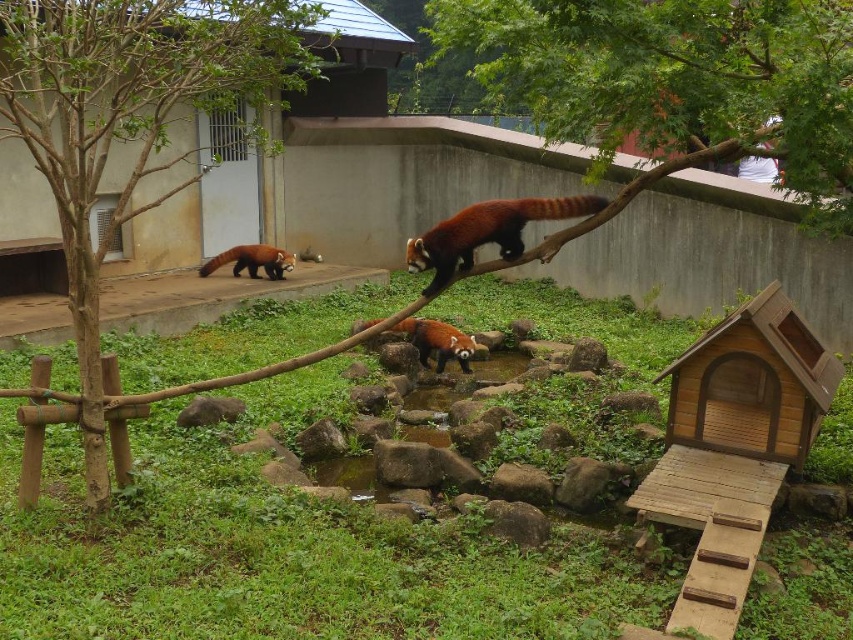
Question: Estimate the real-world distances between objects in this image. Which object is farther from the green leafy tree at left?

Choices:
 (A) fuzzy reddish-brown animal at center
 (B) fluffy reddish-brown panda at upper center
 (C) green leafy tree at upper center

Answer: (A)

Question: Which object is farther from the camera taking this photo?

Choices:
 (A) brown furry animal at center
 (B) green leafy tree at left
 (C) fuzzy reddish-brown animal at center

Answer: (A)

Question: Is fluffy reddish-brown panda at upper center to the right of fuzzy reddish-brown animal at center from the viewer's perspective?

Choices:
 (A) yes
 (B) no

Answer: (A)

Question: Does fluffy reddish-brown panda at upper center appear under brown furry animal at center?

Choices:
 (A) yes
 (B) no

Answer: (A)

Question: Is green leafy tree at left to the right of fuzzy reddish-brown animal at center from the viewer's perspective?

Choices:
 (A) no
 (B) yes

Answer: (A)

Question: Among these objects, which one is nearest to the camera?

Choices:
 (A) green leafy tree at upper center
 (B) green leafy tree at left
 (C) fluffy reddish-brown panda at upper center
 (D) reddish-brown fur at lower left

Answer: (B)